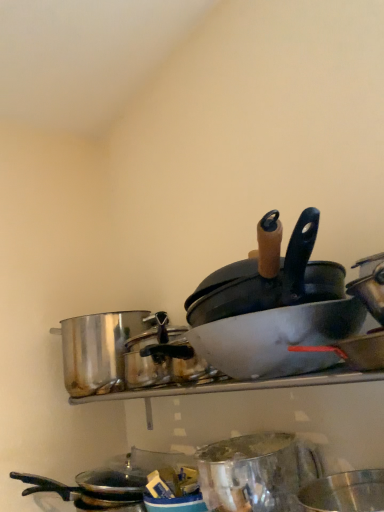
Question: Considering the relative sizes of shiny metallic basin at lower right, the 2th basin when ordered from top to bottom, and metallic silver basin at center, arranged as the second basin when ordered from the bottom, in the image provided, is shiny metallic basin at lower right, the 2th basin when ordered from top to bottom, wider than metallic silver basin at center, arranged as the second basin when ordered from the bottom,?

Choices:
 (A) yes
 (B) no

Answer: (B)

Question: Would you consider shiny metallic basin at lower right, which appears as the 1th basin when ordered from the bottom, to be distant from metallic silver basin at center, arranged as the second basin when ordered from the bottom?

Choices:
 (A) yes
 (B) no

Answer: (B)

Question: Is shiny metallic basin at lower right, which appears as the 1th basin when ordered from the bottom, smaller than metallic silver basin at center, arranged as the second basin when ordered from the bottom?

Choices:
 (A) no
 (B) yes

Answer: (B)

Question: Is shiny metallic basin at lower right, the 2th basin when ordered from top to bottom, to the right of metallic silver basin at center, which ranks as the 1th basin in top-to-bottom order, from the viewer's perspective?

Choices:
 (A) yes
 (B) no

Answer: (A)

Question: From a real-world perspective, is shiny metallic basin at lower right, the 2th basin when ordered from top to bottom, on top of metallic silver basin at center, arranged as the second basin when ordered from the bottom?

Choices:
 (A) no
 (B) yes

Answer: (A)

Question: In terms of height, does shiny metallic pot at left look taller or shorter compared to metallic silver mixing bowl at center?

Choices:
 (A) short
 (B) tall

Answer: (B)

Question: Is shiny metallic pot at left inside the boundaries of metallic silver mixing bowl at center, or outside?

Choices:
 (A) inside
 (B) outside

Answer: (B)

Question: Visually, is shiny metallic pot at left positioned to the left or to the right of metallic silver mixing bowl at center?

Choices:
 (A) right
 (B) left

Answer: (B)

Question: Considering their positions, is shiny metallic pot at left located in front of or behind metallic silver mixing bowl at center?

Choices:
 (A) front
 (B) behind

Answer: (B)

Question: Is point (360, 347) positioned closer to the camera than point (231, 483)?

Choices:
 (A) closer
 (B) farther

Answer: (A)

Question: Looking at their shapes, would you say matte white wok at center is wider or thinner than metallic silver mixing bowl at center?

Choices:
 (A) wide
 (B) thin

Answer: (B)

Question: Is matte white wok at center inside the boundaries of metallic silver mixing bowl at center, or outside?

Choices:
 (A) inside
 (B) outside

Answer: (B)

Question: From a real-world perspective, relative to metallic silver mixing bowl at center, is matte white wok at center vertically above or below?

Choices:
 (A) above
 (B) below

Answer: (A)

Question: Considering the positions of matte white wok at center and metallic silver basin at center, which ranks as the 1th basin in top-to-bottom order, in the image, is matte white wok at center taller or shorter than metallic silver basin at center, which ranks as the 1th basin in top-to-bottom order,?

Choices:
 (A) tall
 (B) short

Answer: (B)

Question: In terms of size, does matte white wok at center appear bigger or smaller than metallic silver basin at center, which ranks as the 1th basin in top-to-bottom order?

Choices:
 (A) big
 (B) small

Answer: (B)